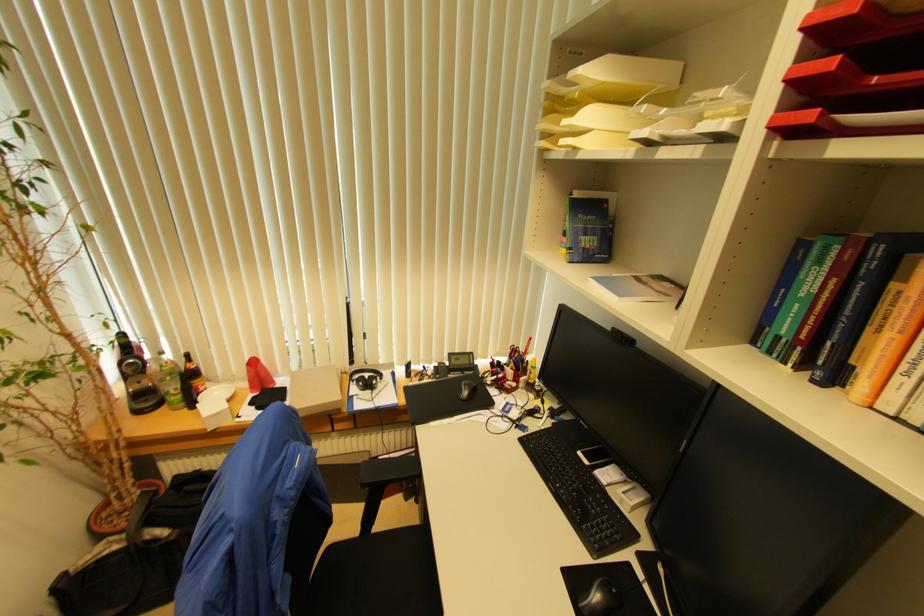
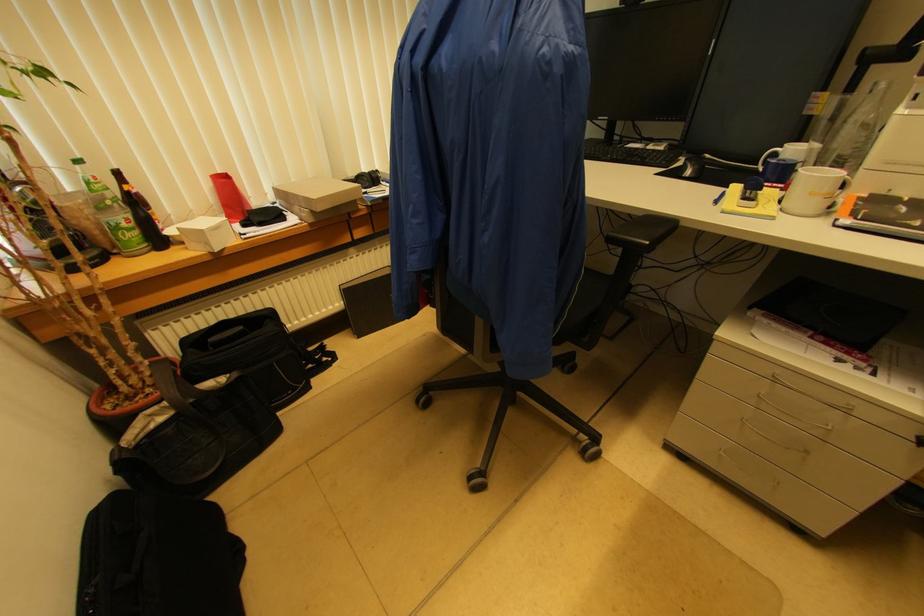
Locate, in the second image, the point that corresponds to [130,541] in the first image.

(175, 408)